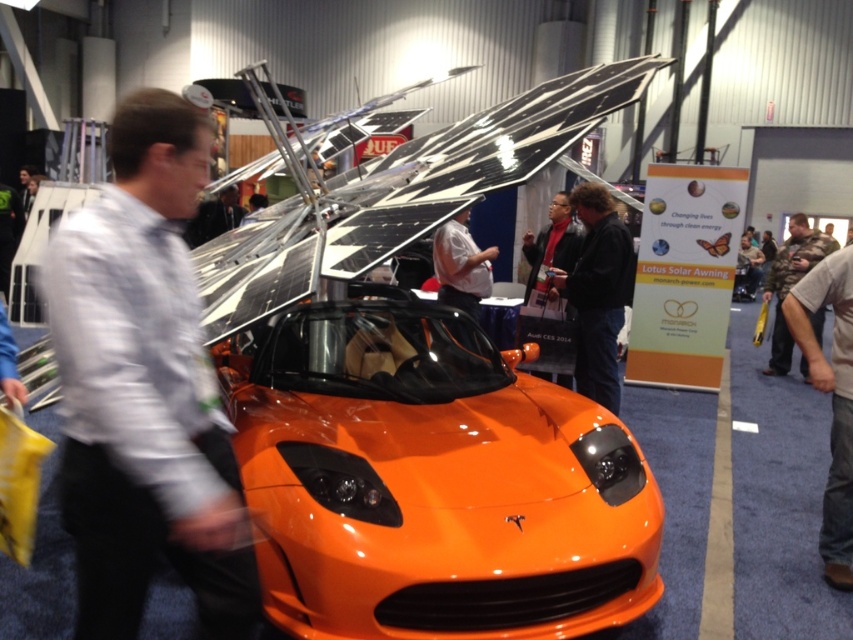
Question: Which is farther from the matte black jacket at center?

Choices:
 (A) white shirt at center
 (B) dark brown leather jacket at center
 (C) white shirt at left
 (D) glossy orange sports car at center

Answer: (C)

Question: Is brown denim pants at lower right positioned in front of matte black jacket at center?

Choices:
 (A) yes
 (B) no

Answer: (A)

Question: Which of these objects is positioned closest to the white shirt at center?

Choices:
 (A) glossy orange sports car at center
 (B) camouflage fabric shirt at right

Answer: (A)

Question: Does dark brown leather jacket at center appear on the left side of camouflage fabric shirt at right?

Choices:
 (A) yes
 (B) no

Answer: (A)

Question: Which of these objects is positioned farthest from the glossy orange sports car at center?

Choices:
 (A) camouflage fabric shirt at right
 (B) matte black jacket at center

Answer: (A)

Question: Is glossy orange sports car at center further to camera compared to dark brown leather jacket at center?

Choices:
 (A) yes
 (B) no

Answer: (B)